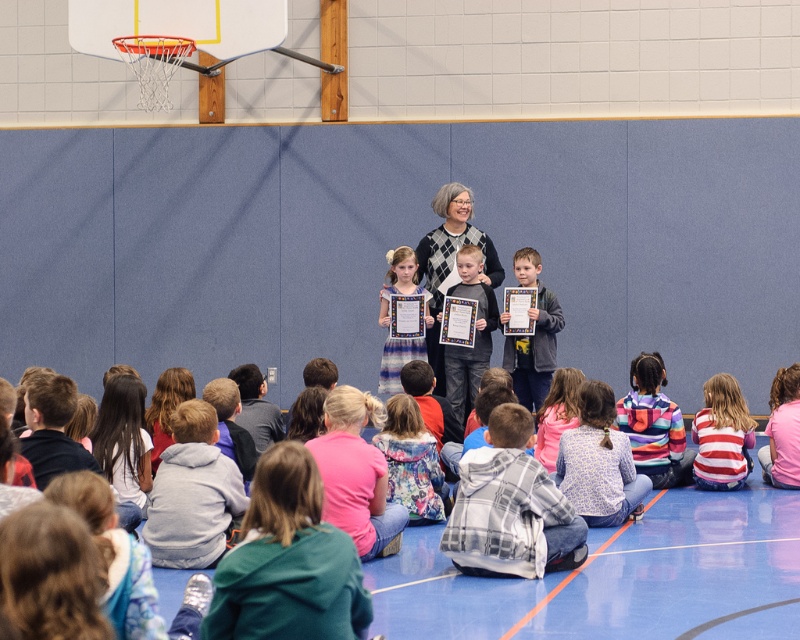
Is floral-patterned jacket at center in front of light brown wooden frame at center?

Yes, it is.

The width and height of the screenshot is (800, 640). I want to click on floral-patterned jacket at center, so click(x=412, y=461).

Find the location of a particular element. The width and height of the screenshot is (800, 640). floral-patterned jacket at center is located at coordinates (412, 461).

Who is lower down, green fleece jacket at lower center or floral dress at center?

floral dress at center is lower down.

Find the location of a particular element. The image size is (800, 640). green fleece jacket at lower center is located at coordinates point(288,561).

The image size is (800, 640). I want to click on green fleece jacket at lower center, so click(288, 561).

Is point (308, 490) behind point (530, 468)?

No, it is not.

Between green fleece jacket at lower center and plaid hoodie at lower center, which one has less height?

green fleece jacket at lower center

The height and width of the screenshot is (640, 800). Identify the location of green fleece jacket at lower center. (288, 561).